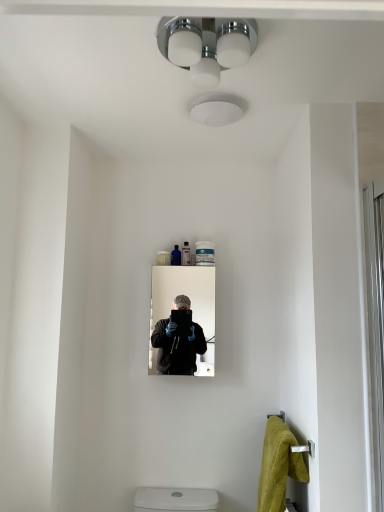
Question: Which direction should I rotate to face translucent plastic tube at center, the first toiletry from the right, — up or down?

Choices:
 (A) up
 (B) down

Answer: (A)

Question: From a real-world perspective, is white glossy screen door at right over translucent plastic tube at center, the first toiletry from the right?

Choices:
 (A) no
 (B) yes

Answer: (A)

Question: Is white glossy screen door at right facing towards translucent plastic tube at center, the first toiletry from the right?

Choices:
 (A) no
 (B) yes

Answer: (A)

Question: Is white glossy screen door at right placed right next to translucent plastic tube at center, which is the second toiletry from left to right?

Choices:
 (A) no
 (B) yes

Answer: (A)

Question: From the image's perspective, is white glossy screen door at right below translucent plastic tube at center, which is the second toiletry from left to right?

Choices:
 (A) no
 (B) yes

Answer: (B)

Question: Is white glossy screen door at right positioned with its back to translucent plastic tube at center, which is the second toiletry from left to right?

Choices:
 (A) yes
 (B) no

Answer: (B)

Question: Considering the relative positions of white glossy screen door at right and translucent plastic tube at center, the first toiletry from the right, in the image provided, is white glossy screen door at right to the left of translucent plastic tube at center, the first toiletry from the right, from the viewer's perspective?

Choices:
 (A) no
 (B) yes

Answer: (A)

Question: Does matte black mirror at center lie in front of yellow plush towel at lower right?

Choices:
 (A) no
 (B) yes

Answer: (A)

Question: Is matte black mirror at center oriented away from yellow plush towel at lower right?

Choices:
 (A) no
 (B) yes

Answer: (A)

Question: Is the surface of matte black mirror at center in direct contact with yellow plush towel at lower right?

Choices:
 (A) yes
 (B) no

Answer: (B)

Question: Does matte black mirror at center have a smaller size compared to yellow plush towel at lower right?

Choices:
 (A) no
 (B) yes

Answer: (B)

Question: From the image's perspective, is matte black mirror at center above yellow plush towel at lower right?

Choices:
 (A) yes
 (B) no

Answer: (A)

Question: Is matte black mirror at center behind yellow plush towel at lower right?

Choices:
 (A) no
 (B) yes

Answer: (B)

Question: Is yellow plush towel at lower right thinner than translucent plastic tube at center, the first toiletry from the right?

Choices:
 (A) yes
 (B) no

Answer: (B)